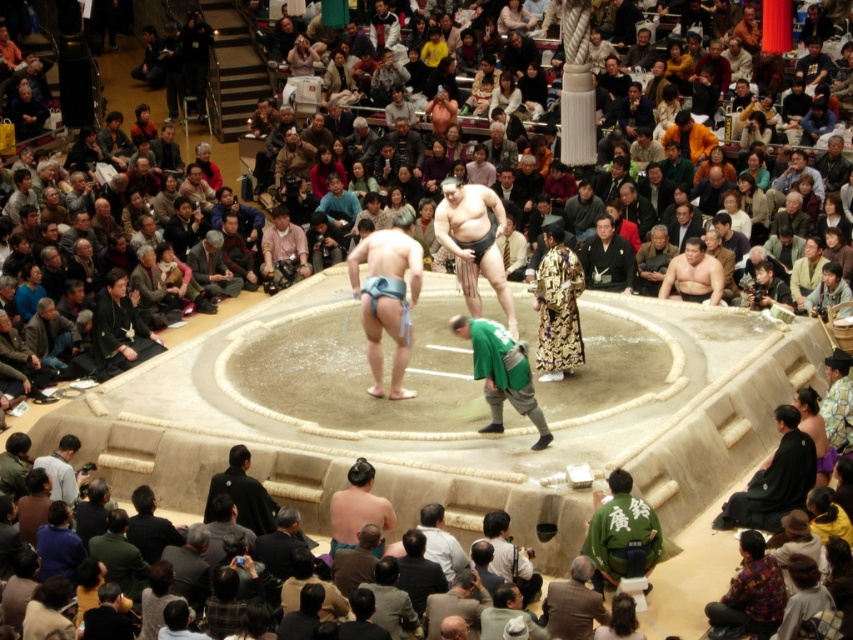
You are a spectator sitting at the edge of the dohyo watching the sumo match. You notice two participants wearing distinct clothing items. Which clothing item is positioned closer to you between the dark brown kimono at lower center and the matte pink shirt at center?

The dark brown kimono at lower center is closer to the viewer than the matte pink shirt at center.